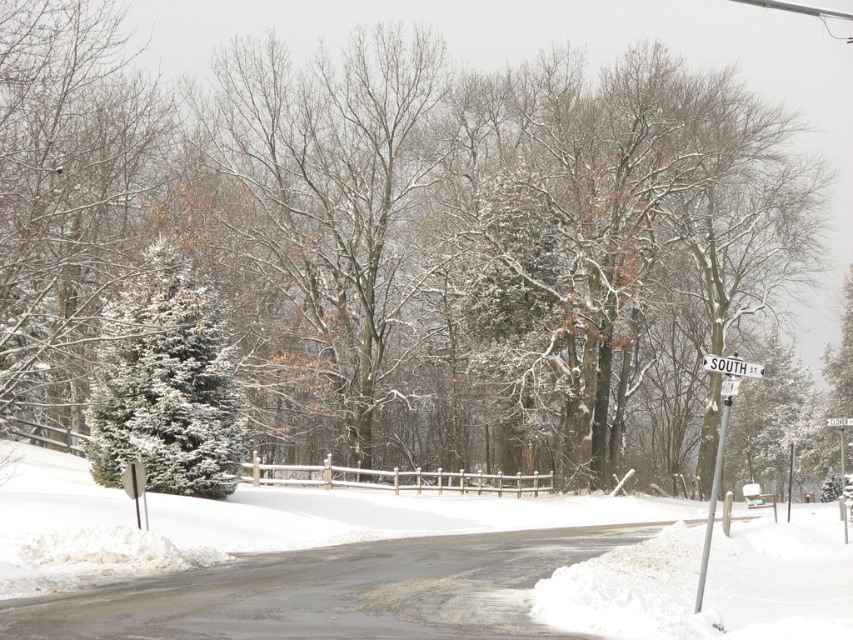
You are a delivery driver planning to drive through the snowy road. The white fluffy snow at center and the white plastic street sign at upper center are in your path. Which one has a wider width according to the scene?

The white fluffy snow at center has a larger width than the white plastic street sign at upper center, so the snow is wider.

You are a delivery driver approaching this snowy intersection. You need to know which object on the left or right side is narrower so you can safely navigate around it. Which one is thinner between the green matte evergreen tree at left and the silver metallic pole at right?

The green matte evergreen tree at left is thinner than the silver metallic pole at right, so it is the narrower object you can safely navigate around.

You are a snowplow driver who needs to clear the snow around the white plastic street sign at upper center. The snowplow can reach up to 8 meters. Is the white fluffy snow at center within the snowplow reach?

The white fluffy snow at center is 8.65 meters from the white plastic street sign at upper center. Since the snowplow can only reach up to 8 meters, the snowplow cannot reach the white fluffy snow at center.